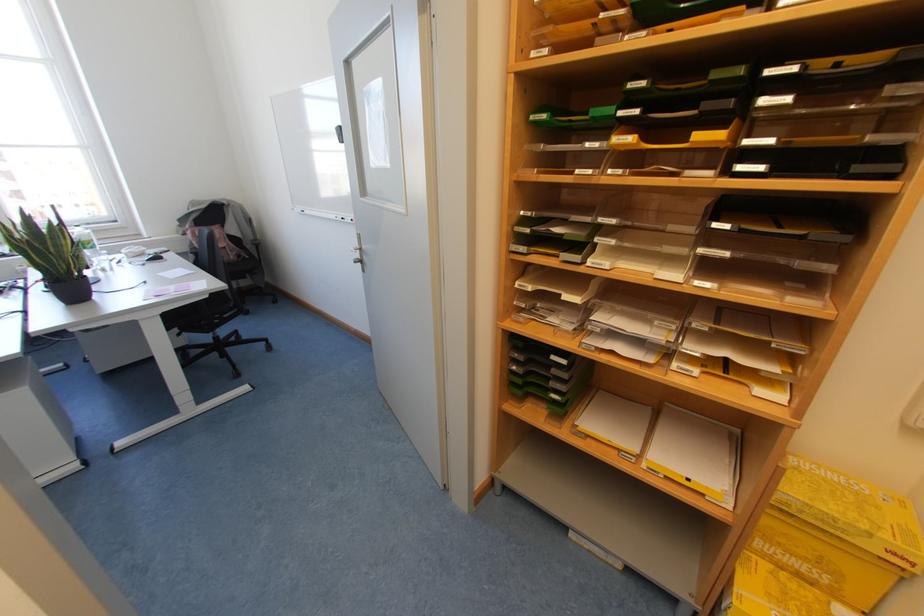
Where is `metal door handle`? The image size is (924, 616). metal door handle is located at coordinates (359, 254).